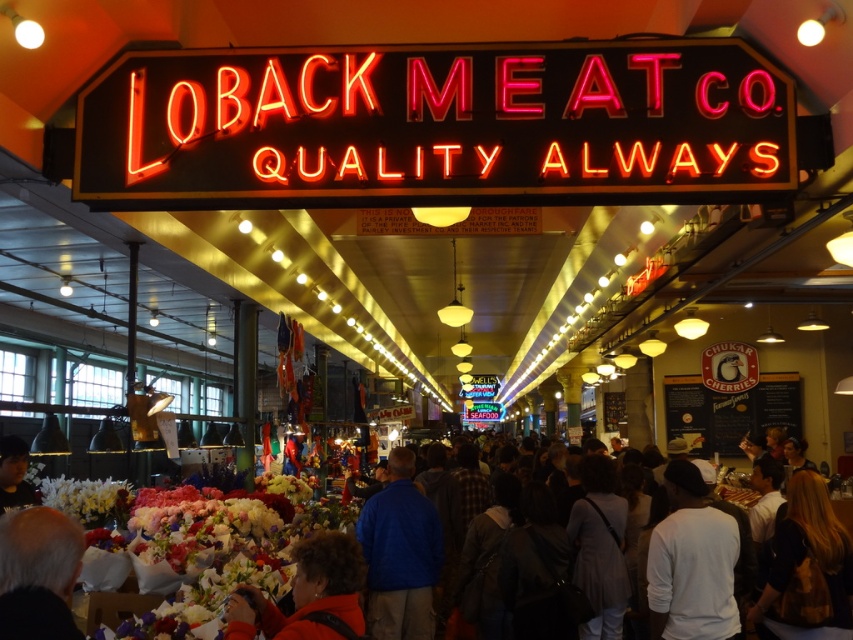
Is point (651, 552) farther from camera compared to point (33, 600)?

That is True.

Between point (708, 616) and point (68, 584), which one is positioned behind?

The point (708, 616) is more distant.

Which is in front, point (732, 561) or point (62, 624)?

Point (62, 624) is more forward.

Locate an element on the screen. white matte shirt at center is located at coordinates (691, 563).

From the picture: Which of these two, dark gray clothing at center or red sweater at lower left, stands shorter?

Standing shorter between the two is red sweater at lower left.

Is dark gray clothing at center above red sweater at lower left?

Incorrect, dark gray clothing at center is not positioned above red sweater at lower left.

Find the location of a particular element. The width and height of the screenshot is (853, 640). dark gray clothing at center is located at coordinates (819, 556).

Where is `dark gray clothing at center`? dark gray clothing at center is located at coordinates (819, 556).

Does blue fabric jacket at center have a smaller size compared to red sweater at lower left?

No, blue fabric jacket at center is not smaller than red sweater at lower left.

Can you confirm if blue fabric jacket at center is thinner than red sweater at lower left?

Incorrect, blue fabric jacket at center's width is not less than red sweater at lower left's.

Does point (386, 605) come in front of point (338, 570)?

No, it is behind (338, 570).

What are the coordinates of `blue fabric jacket at center` in the screenshot? It's located at (399, 554).